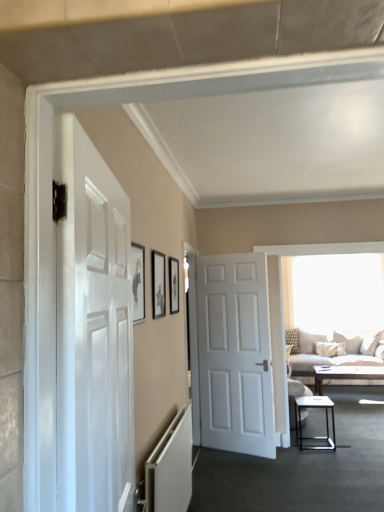
Question: Which direction should I rotate to face matte black picture frame at upper center, which is the third picture frame from back to front, — up or down?

Choices:
 (A) down
 (B) up

Answer: (A)

Question: Are beige fabric couch at right and white matte door at center, positioned as the 1th door in right-to-left order, far apart?

Choices:
 (A) no
 (B) yes

Answer: (B)

Question: Is beige fabric couch at right in front of white matte door at center, positioned as the 1th door in right-to-left order?

Choices:
 (A) no
 (B) yes

Answer: (A)

Question: Can you see beige fabric couch at right touching white matte door at center, the second door when ordered from front to back?

Choices:
 (A) yes
 (B) no

Answer: (B)

Question: Can you confirm if beige fabric couch at right is shorter than white matte door at center, the second door when ordered from front to back?

Choices:
 (A) no
 (B) yes

Answer: (B)

Question: Is beige fabric couch at right wider than white matte door at center, which is the 2th door from left to right?

Choices:
 (A) yes
 (B) no

Answer: (A)

Question: Is beige fabric couch at right looking in the opposite direction of white matte door at center, which is the 2th door from left to right?

Choices:
 (A) no
 (B) yes

Answer: (A)

Question: From a real-world perspective, does white glossy door at left, the 2th door when ordered from right to left, stand above matte black picture frame at center, which is the 2th picture frame in back-to-front order?

Choices:
 (A) no
 (B) yes

Answer: (A)

Question: Can we say white glossy door at left, which ranks as the first door in front-to-back order, lies outside matte black picture frame at center, the second picture frame in the front-to-back sequence?

Choices:
 (A) yes
 (B) no

Answer: (A)

Question: Considering the relative sizes of white glossy door at left, the first door in the left-to-right sequence, and matte black picture frame at center, which is the 2th picture frame in back-to-front order, in the image provided, is white glossy door at left, the first door in the left-to-right sequence, taller than matte black picture frame at center, which is the 2th picture frame in back-to-front order,?

Choices:
 (A) no
 (B) yes

Answer: (B)

Question: Considering the relative positions of white glossy door at left, the 2th door when ordered from right to left, and matte black picture frame at center, which is the 2th picture frame in back-to-front order, in the image provided, is white glossy door at left, the 2th door when ordered from right to left, to the right of matte black picture frame at center, which is the 2th picture frame in back-to-front order, from the viewer's perspective?

Choices:
 (A) no
 (B) yes

Answer: (A)

Question: Is white glossy door at left, the 2th door when ordered from right to left, not near matte black picture frame at center, which appears as the second picture frame when viewed from the right?

Choices:
 (A) no
 (B) yes

Answer: (B)

Question: Is white glossy door at left, placed as the second door when sorted from back to front, facing away from matte black picture frame at center, which is the 2th picture frame in back-to-front order?

Choices:
 (A) yes
 (B) no

Answer: (B)

Question: Is light brown wooden coffee table at center oriented away from matte black picture frame at upper center, marked as the first picture frame in a right-to-left arrangement?

Choices:
 (A) yes
 (B) no

Answer: (B)